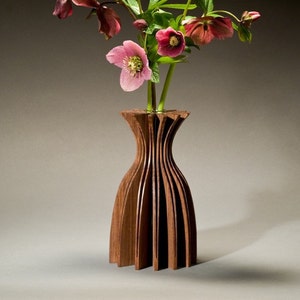
Locate an element on the screen. The height and width of the screenshot is (300, 300). flower vase is located at coordinates (171, 226).